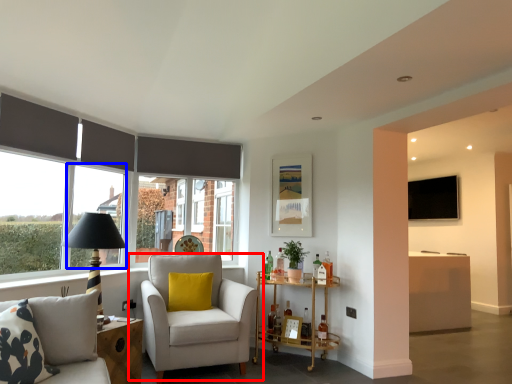
Question: Among these objects, which one is farthest to the camera, chair (highlighted by a red box) or window (highlighted by a blue box)?

Choices:
 (A) chair
 (B) window

Answer: (B)